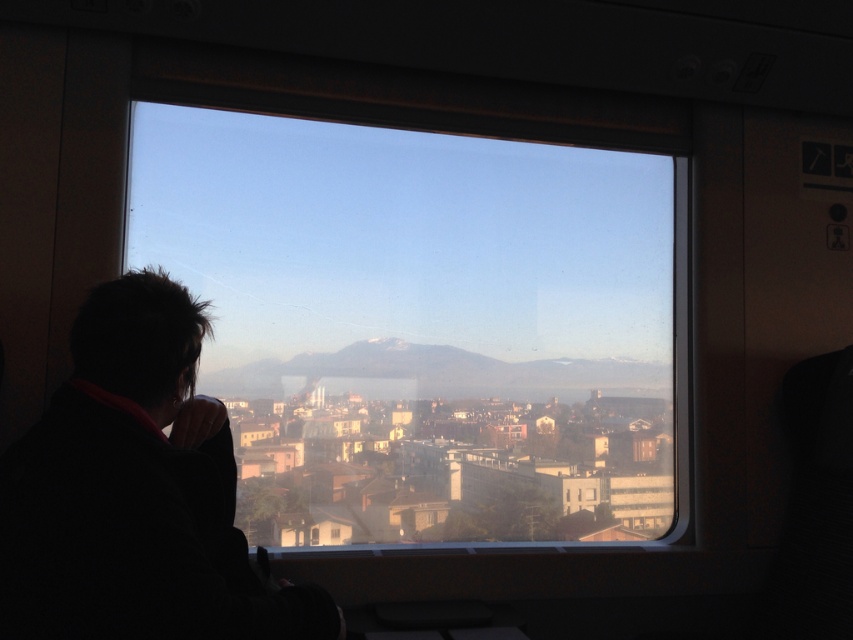
You are a passenger sitting in the train seat facing the transparent glass window at center. Your backpack is on the floor behind you. You want to take a photo of the landscape outside through the window without any obstructions. Since the window is 8.17 feet away from you, can you move your backpack closer to the window to avoid blocking the view?

The transparent glass window at center is 8.17 feet from the camera. If you move your backpack closer to the window, it will be positioned between you and the window, potentially blocking your view. To take an unobstructed photo, keep the backpack away from the window or ensure it doesn

You are sitting in a train seat facing the transparent glass window at center. To your left, there is a black fabric at left. If you want to see the landscape outside through the window, which object should you look through?

You should look through the transparent glass window at center because it allows for an unobstructed view of the scenery outside, while the black fabric at left is opaque and does not provide a clear view.

You are sitting on a train and want to check the time using your phone, which is on the seat next to you. However, you notice that the transparent glass window at center and the black fabric at left are in your way. Which object is closer to your hand if you are reaching from the seat? Please answer based on their distance apart.

The transparent glass window at center and the black fabric at left are 3.52 feet apart from each other. Since you are reaching from the seat, the black fabric at left is closer to your hand than the transparent glass window at center.